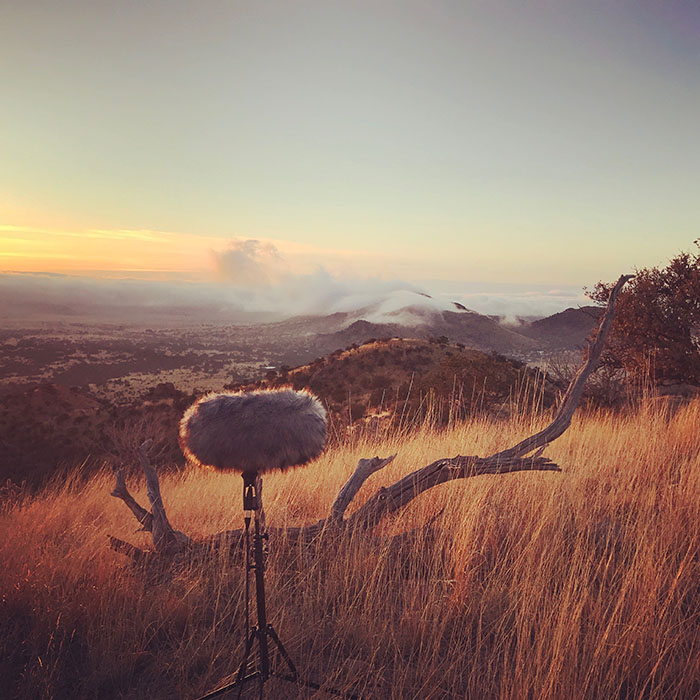
This screenshot has width=700, height=700. I want to click on sound equipment, so click(258, 439), click(246, 614), click(242, 677).